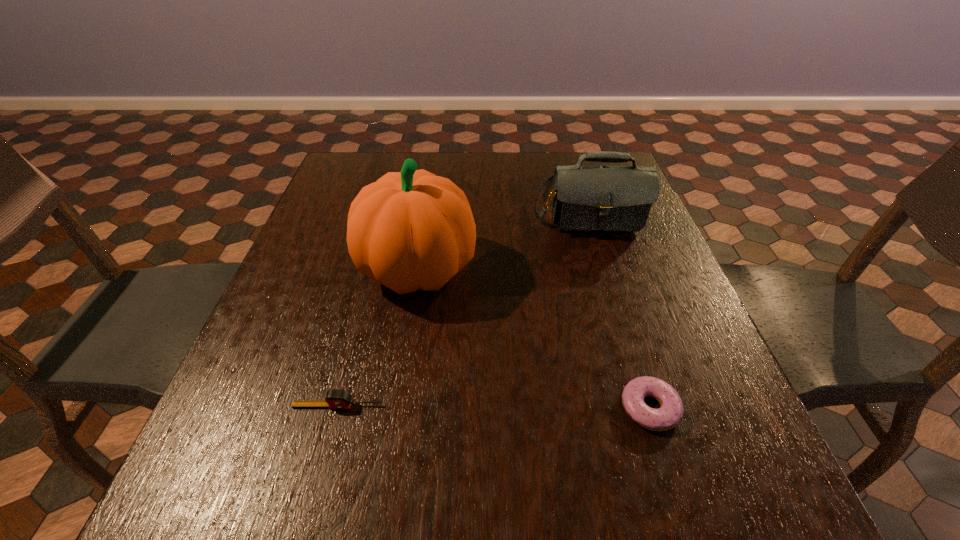
Where is `the third closest object relative to the tallest object`? This screenshot has width=960, height=540. the third closest object relative to the tallest object is located at coordinates (670, 413).

Identify the location of vacant space that satisfies the following two spatial constraints: 1. on the back side of the shoulder bag; 2. on the left side of the pumpkin. The height and width of the screenshot is (540, 960). (427, 205).

Where is `free space that satisfies the following two spatial constraints: 1. on the front side of the pumpkin; 2. on the left side of the shortest object`? The height and width of the screenshot is (540, 960). free space that satisfies the following two spatial constraints: 1. on the front side of the pumpkin; 2. on the left side of the shortest object is located at coordinates (396, 408).

At what (x,y) coordinates should I click in order to perform the action: click on free space that satisfies the following two spatial constraints: 1. on the front side of the shortest object; 2. on the right side of the tape measure. Please return your answer as a coordinate pair (x, y). The image size is (960, 540). Looking at the image, I should click on (337, 408).